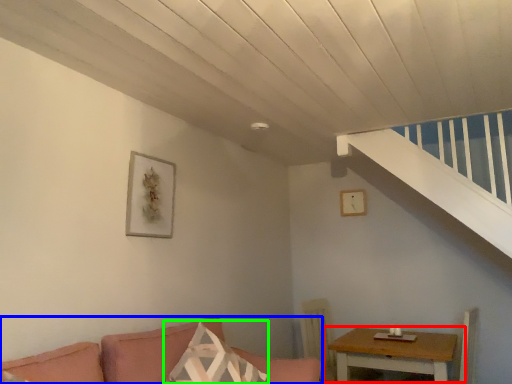
Question: Estimate the real-world distances between objects in this image. Which object is farther from table (highlighted by a red box), studio couch (highlighted by a blue box) or pillow (highlighted by a green box)?

Choices:
 (A) studio couch
 (B) pillow

Answer: (B)